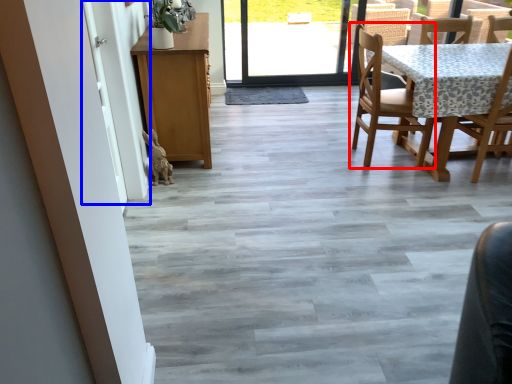
Question: Which of the following is the farthest to the observer, chair (highlighted by a red box) or screen door (highlighted by a blue box)?

Choices:
 (A) chair
 (B) screen door

Answer: (A)